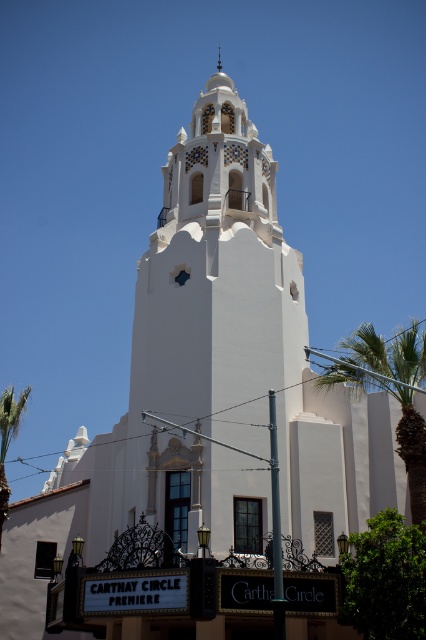
Is white stucco bell tower at center to the right of green leafy palm tree at right from the viewer's perspective?

Incorrect, white stucco bell tower at center is not on the right side of green leafy palm tree at right.

Can you confirm if white stucco bell tower at center is shorter than green leafy palm tree at right?

Incorrect, white stucco bell tower at center's height does not fall short of green leafy palm tree at right's.

Is point (253, 372) behind point (411, 440)?

That is True.

Locate an element on the screen. This screenshot has width=426, height=640. white stucco bell tower at center is located at coordinates (216, 275).